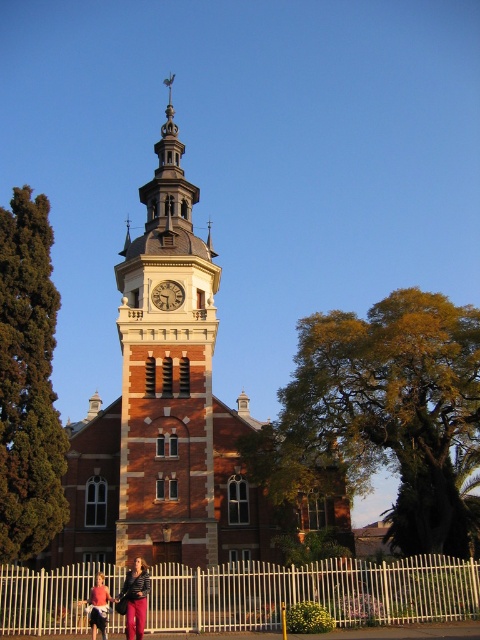
Question: Considering the real-world distances, which object is farthest from the wooden clock at center?

Choices:
 (A) matte black jacket at lower left
 (B) brick clock tower at center

Answer: (A)

Question: Which object is the farthest from the denim pants at lower left?

Choices:
 (A) brick clock tower at center
 (B) brown brick church at center

Answer: (A)

Question: Is brown brick church at center bigger than wooden clock at center?

Choices:
 (A) yes
 (B) no

Answer: (A)

Question: Does white metal fence at lower center have a smaller size compared to matte black jacket at lower left?

Choices:
 (A) yes
 (B) no

Answer: (B)

Question: Which point is closer to the camera?

Choices:
 (A) (142, 620)
 (B) (182, 298)
 (C) (94, 627)

Answer: (A)

Question: Does brown brick church at center have a smaller size compared to white metal fence at lower center?

Choices:
 (A) yes
 (B) no

Answer: (B)